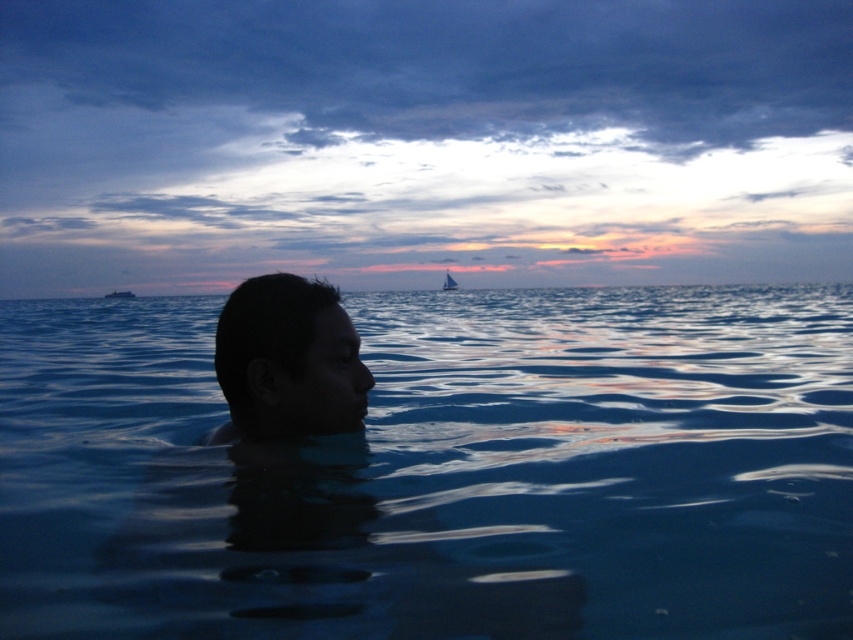
Question: Does transparent blue water at center appear on the right side of white plastic boat at center?

Choices:
 (A) yes
 (B) no

Answer: (A)

Question: Estimate the real-world distances between objects in this image. Which object is closer to the transparent blue water at center?

Choices:
 (A) white plastic boat at center
 (B) dark skin head at center

Answer: (B)

Question: Which of the following is the farthest from the observer?

Choices:
 (A) (445, 269)
 (B) (231, 458)

Answer: (A)

Question: Where is dark skin head at center located in relation to white sailboat at center in the image?

Choices:
 (A) above
 (B) below

Answer: (B)

Question: From the image, what is the correct spatial relationship of dark skin head at center in relation to white plastic boat at center?

Choices:
 (A) below
 (B) above

Answer: (A)

Question: Which point is closer to the camera?

Choices:
 (A) (119, 296)
 (B) (447, 272)
 (C) (170, 305)

Answer: (C)